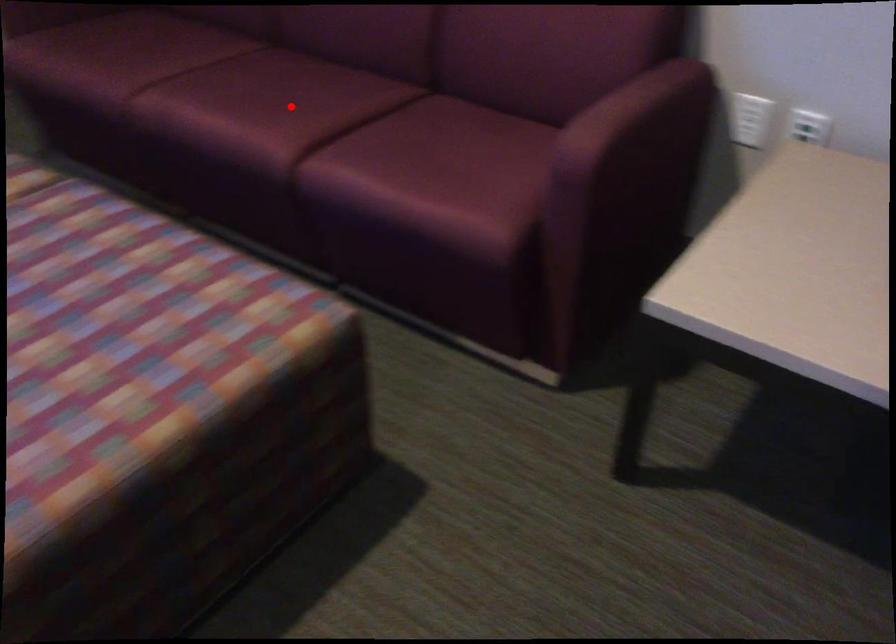
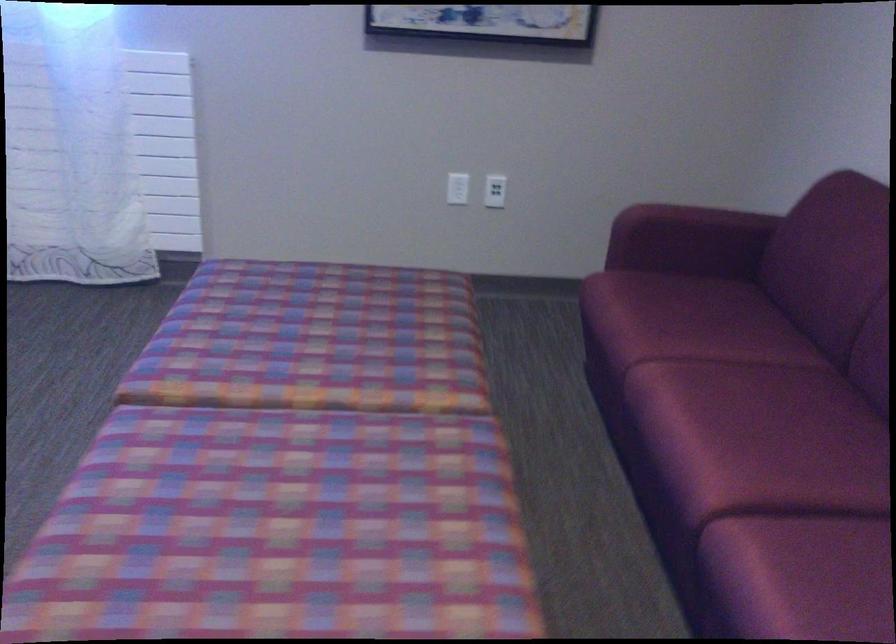
The point at the highlighted location is marked in the first image. Where is the corresponding point in the second image?

(764, 456)